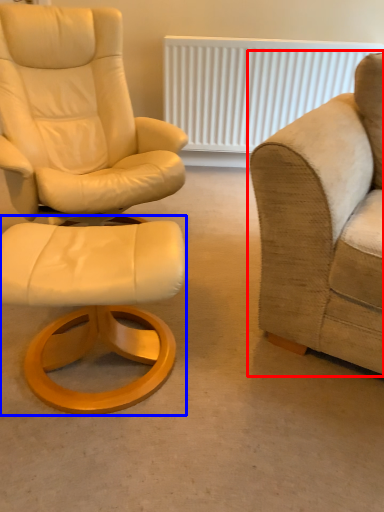
Question: Which point is further to the camera, studio couch (highlighted by a red box) or stool (highlighted by a blue box)?

Choices:
 (A) studio couch
 (B) stool

Answer: (B)